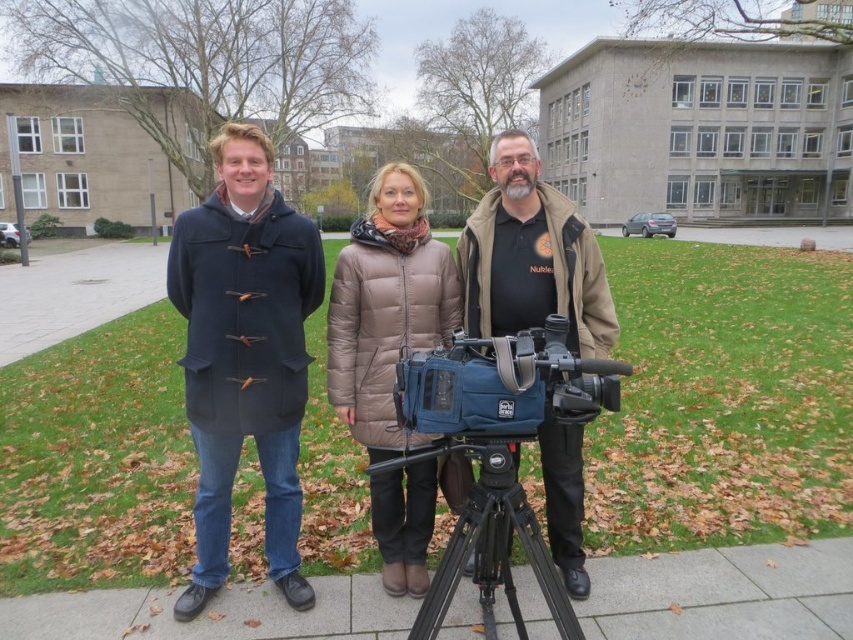
You are a photographer positioned 10 feet away from the dark blue wool coat at left and brown puffer coat at center. You want to capture both individuals in a single frame without moving. Can you fit both in the shot if your camera has a 50mm lens with a field of view of 46 degrees?

The distance between dark blue wool coat at left and brown puffer coat at center is 30.23 inches. To determine if they fit within the 46 degree field of view at 10 feet, we calculate the maximum width as 2 x 10ft x tan 23 degrees. Converting 10 feet to inches gives 120 inches. The calculation yields 2 x 120 x tan 23. The tangent of 23 degrees is approximately 0.424. Multiplying gives 2 x 120 x 0.424 equals 101.76 inches. Since 30.23 inches is less than 101.76 inches, both individuals can fit within the 46.5

You are standing at the point labeled as point [723,593] in the image. Looking around, you notice three people nearby. The person on the left is wearing a dark blue coat with toggle closures, the individual in the center is in a light brown puffer jacket, and the person on the right is wearing... What surface are you currently standing on?

You are standing on the gray concrete pavement at lower center, as indicated by the point [723,593].